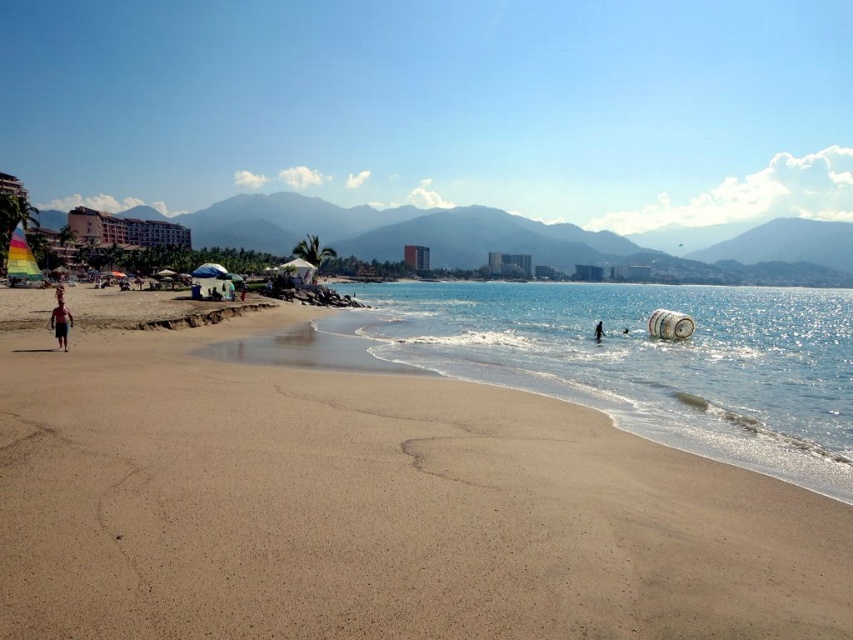
Question: Among these objects, which one is nearest to the camera?

Choices:
 (A) tan skin person at left
 (B) smooth skin person at lower right
 (C) smooth sand at lower center
 (D) clear blue water at center

Answer: (C)

Question: Is tan skin person at left to the right of smooth skin person at lower right from the viewer's perspective?

Choices:
 (A) no
 (B) yes

Answer: (A)

Question: Which of these objects is positioned farthest from the smooth sand at lower center?

Choices:
 (A) clear blue water at center
 (B) smooth skin person at lower right
 (C) tan skin person at left

Answer: (A)

Question: Which object appears closest to the camera in this image?

Choices:
 (A) smooth sand at lower center
 (B) clear blue water at center
 (C) tan skin person at left
 (D) smooth skin person at lower right

Answer: (A)

Question: Where is smooth sand at lower center located in relation to clear blue water at center in the image?

Choices:
 (A) left
 (B) right

Answer: (A)

Question: Can you confirm if clear blue water at center is thinner than smooth skin person at lower right?

Choices:
 (A) yes
 (B) no

Answer: (B)